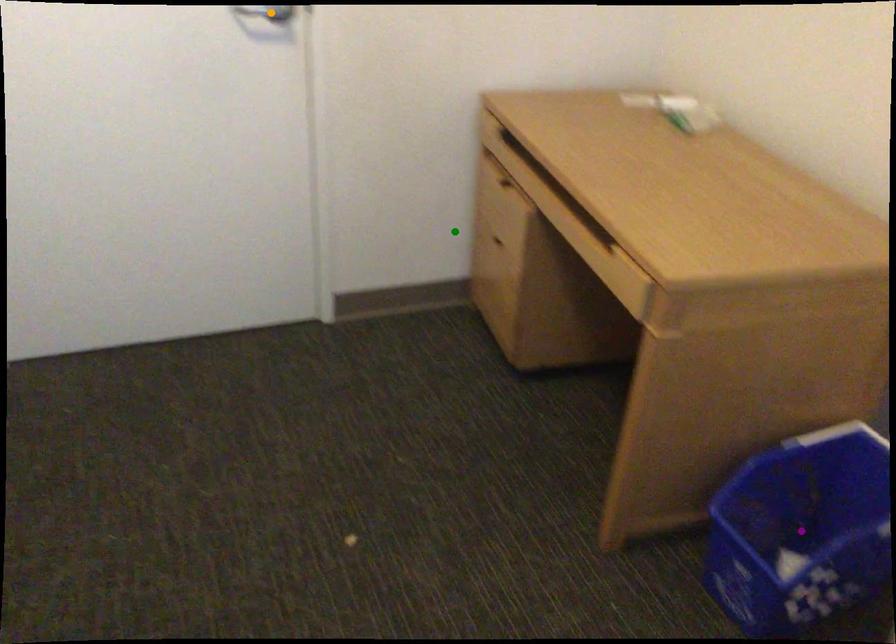
Order these from farthest to nearest:
green point
purple point
orange point

green point → orange point → purple point